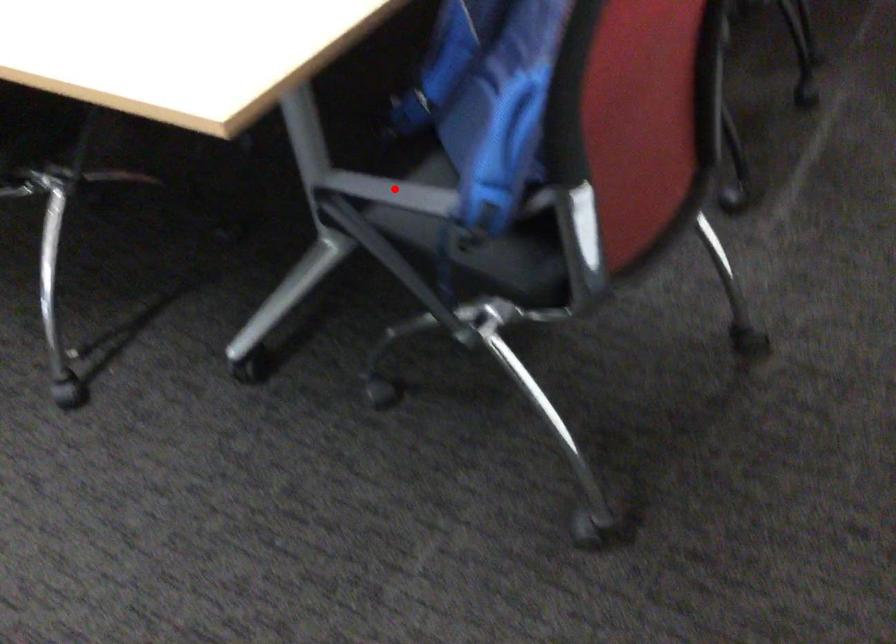
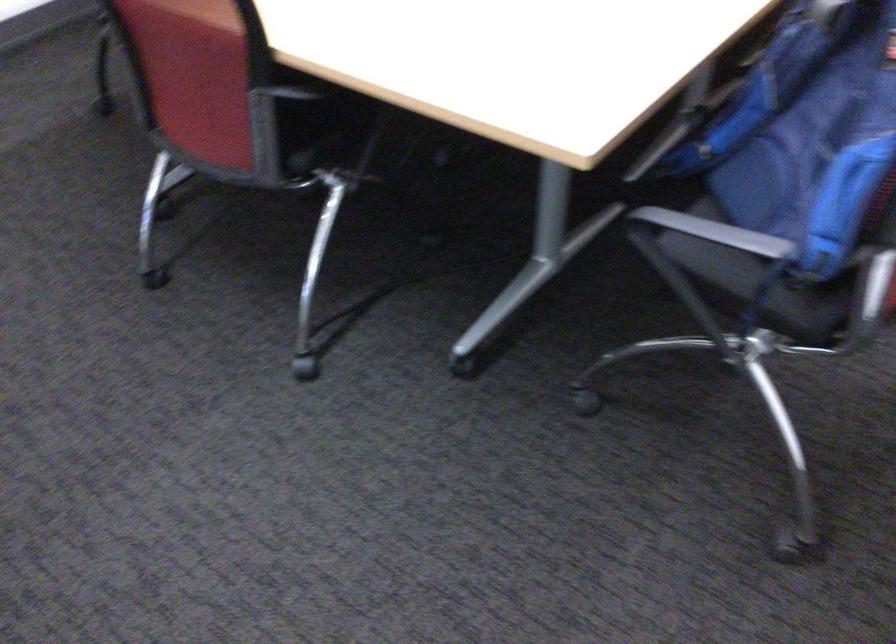
Where in the second image is the point corresponding to the highlighted location from the first image?

(716, 232)